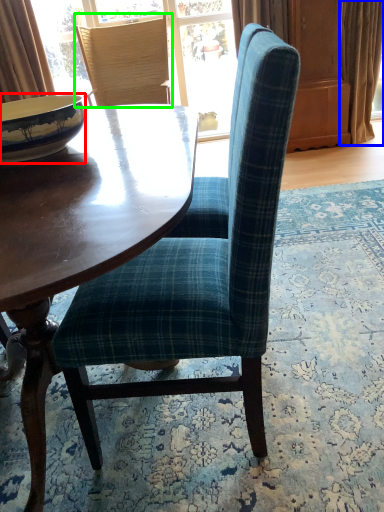
Question: Which is farther away from bowl (highlighted by a red box)? curtain (highlighted by a blue box) or chair (highlighted by a green box)?

Choices:
 (A) curtain
 (B) chair

Answer: (A)